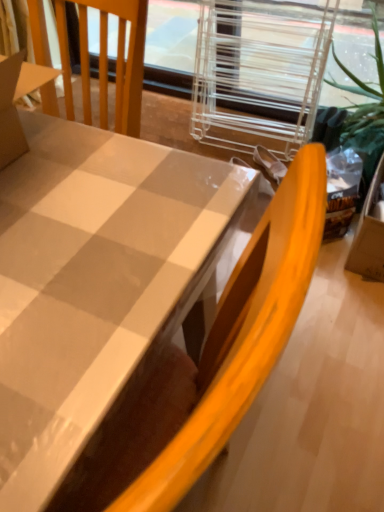
The width and height of the screenshot is (384, 512). In order to click on white glossy table at center in this screenshot , I will do `click(94, 284)`.

This screenshot has width=384, height=512. What do you see at coordinates (94, 284) in the screenshot? I see `white glossy table at center` at bounding box center [94, 284].

Locate an element on the screen. The width and height of the screenshot is (384, 512). white glossy table at center is located at coordinates (94, 284).